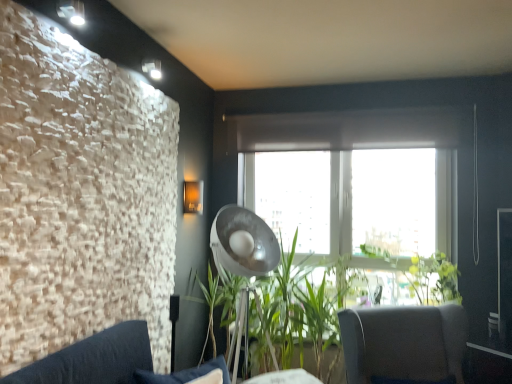
Question: Would you say green leafy plant at center is part of green leafy plant at center's contents?

Choices:
 (A) yes
 (B) no

Answer: (B)

Question: From a real-world perspective, is green leafy plant at center below green leafy plant at center?

Choices:
 (A) no
 (B) yes

Answer: (A)

Question: From a real-world perspective, is green leafy plant at center on green leafy plant at center?

Choices:
 (A) yes
 (B) no

Answer: (A)

Question: Is green leafy plant at center shorter than green leafy plant at center?

Choices:
 (A) yes
 (B) no

Answer: (A)

Question: Can you confirm if green leafy plant at center is positioned to the left of green leafy plant at center?

Choices:
 (A) yes
 (B) no

Answer: (B)

Question: Is green leafy plant at center not near green leafy plant at center?

Choices:
 (A) yes
 (B) no

Answer: (B)

Question: Is dark gray fabric chair at lower right beside dark gray fabric couch at lower left?

Choices:
 (A) yes
 (B) no

Answer: (B)

Question: Is dark gray fabric couch at lower left inside dark gray fabric chair at lower right?

Choices:
 (A) yes
 (B) no

Answer: (B)

Question: Is the depth of dark gray fabric chair at lower right less than that of dark gray fabric couch at lower left?

Choices:
 (A) no
 (B) yes

Answer: (A)

Question: Is dark gray fabric chair at lower right oriented away from dark gray fabric couch at lower left?

Choices:
 (A) yes
 (B) no

Answer: (B)

Question: Is dark gray fabric chair at lower right not near dark gray fabric couch at lower left?

Choices:
 (A) yes
 (B) no

Answer: (A)

Question: Does dark gray fabric chair at lower right have a greater height compared to dark gray fabric couch at lower left?

Choices:
 (A) no
 (B) yes

Answer: (B)

Question: Does green leafy plant at center have a larger size compared to dark gray fabric couch at lower left?

Choices:
 (A) no
 (B) yes

Answer: (B)